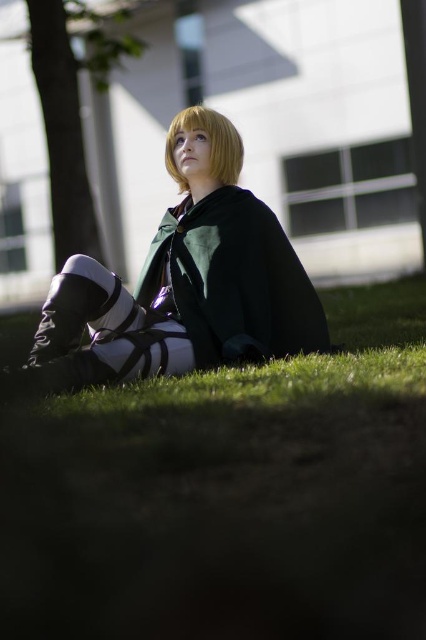
You are standing at the center of the image and want to take a photo of the green leafy tree at left. In which direction should you move to get a better view of the tree?

Since the green leafy tree at left is located at point (72,106), you should move to your left to get a better view of the tree.

You are a photographer trying to capture a closeup of the matte green cape at center and the blonde hair at upper center in the image. Can you fit both subjects into a single frame if your camera has a maximum field of view of 50 centimeters?

The matte green cape at center and the blonde hair at upper center are 47.73 centimeters apart. Since the distance between them is less than the camera field of view of 50 centimeters, both subjects can fit into a single frame.

You are a photographer standing 3 meters away from the matte green cape at center. You want to take a closeup shot of it. Is your current distance sufficient to capture the cape clearly in the photo?

The matte green cape at center is 3.11 meters away from the camera. Since you are standing 3 meters away, you are slightly closer than the required distance. Move back approximately 0.11 meters to ensure the cape is in focus.